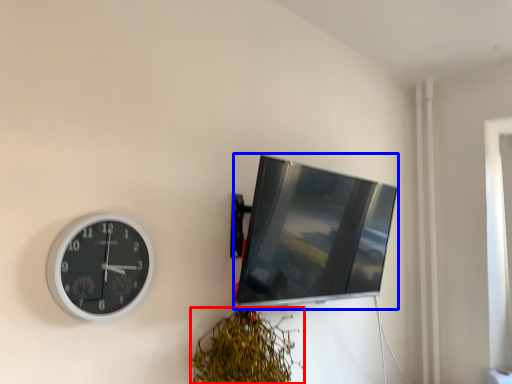
Question: Which of the following is the closest to the observer, vegetation (highlighted by a red box) or computer monitor (highlighted by a blue box)?

Choices:
 (A) vegetation
 (B) computer monitor

Answer: (A)